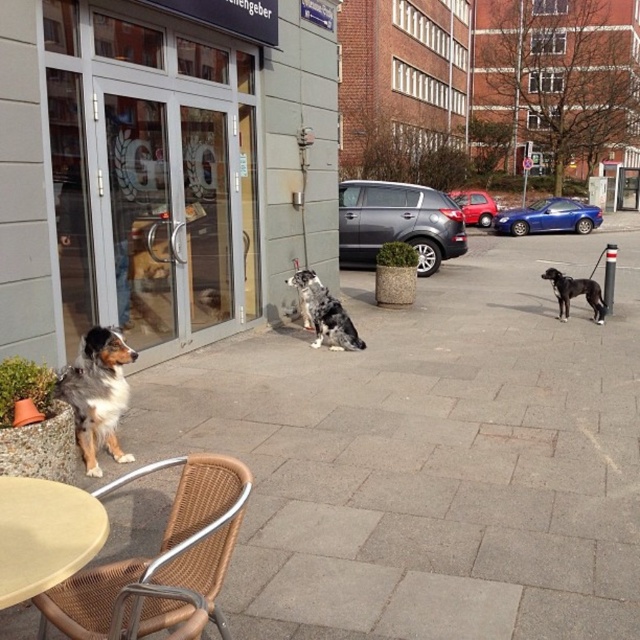
Question: Which object is positioned farthest from the beige plastic table at lower left?

Choices:
 (A) brown and white fur dog at lower left
 (B) metallic silver sedan at center

Answer: (B)

Question: Which object is farther from the camera taking this photo?

Choices:
 (A) rattan chair at lower left
 (B) satin silver car at center
 (C) shiny blue car at center right
 (D) gray concrete pavement at lower left

Answer: (C)

Question: Among these objects, which one is farthest from the camera?

Choices:
 (A) transparent glass doors at center
 (B) gray concrete pavement at lower left
 (C) black and white fur dog at center
 (D) brown and white fur dog at lower left

Answer: (C)

Question: Can you confirm if beige plastic table at lower left is smaller than black and white fur dog at center?

Choices:
 (A) yes
 (B) no

Answer: (A)

Question: Is brown and white fur dog at lower left above black and white fur dog at center?

Choices:
 (A) yes
 (B) no

Answer: (B)

Question: Is beige plastic table at lower left behind brown and white fur dog at lower left?

Choices:
 (A) no
 (B) yes

Answer: (A)